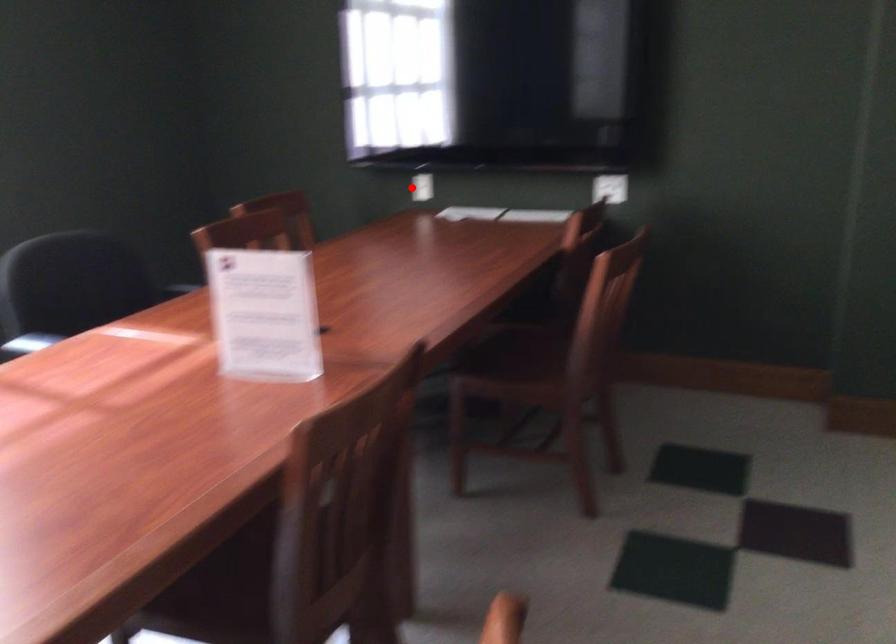
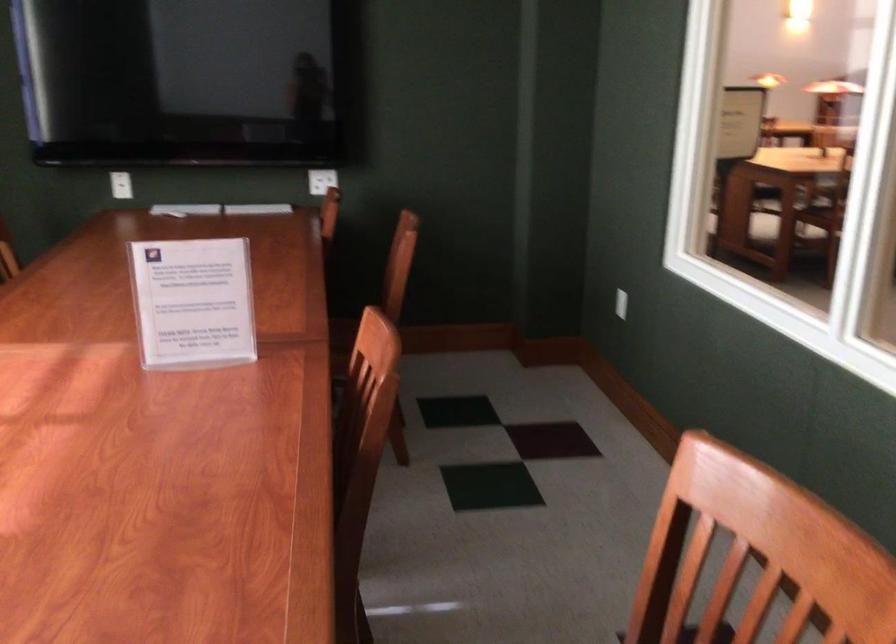
The point at the highlighted location is marked in the first image. Where is the corresponding point in the second image?

(121, 185)